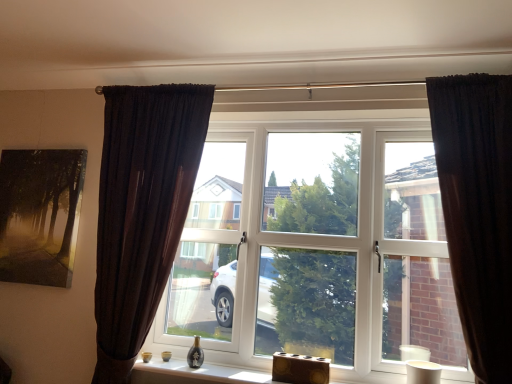
Image resolution: width=512 pixels, height=384 pixels. In order to click on vacant region above matte black painting at upper left (from a real-world perspective) in this screenshot , I will do `click(44, 148)`.